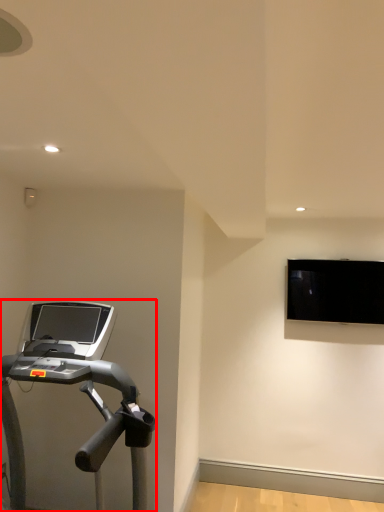
Question: Considering the relative positions of treadmill (annotated by the red box) and computer monitor in the image provided, where is treadmill (annotated by the red box) located with respect to the staircase?

Choices:
 (A) left
 (B) right

Answer: (A)